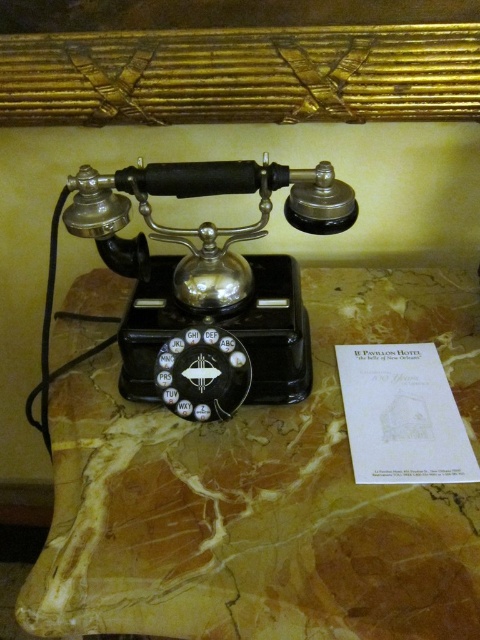
Question: Considering the relative positions of marble at center and black polished rotary phone at center in the image provided, where is marble at center located with respect to black polished rotary phone at center?

Choices:
 (A) right
 (B) left

Answer: (A)

Question: Can you confirm if marble at center is bigger than black polished rotary phone at center?

Choices:
 (A) no
 (B) yes

Answer: (B)

Question: In this image, where is marble at center located relative to black polished rotary phone at center?

Choices:
 (A) left
 (B) right

Answer: (B)